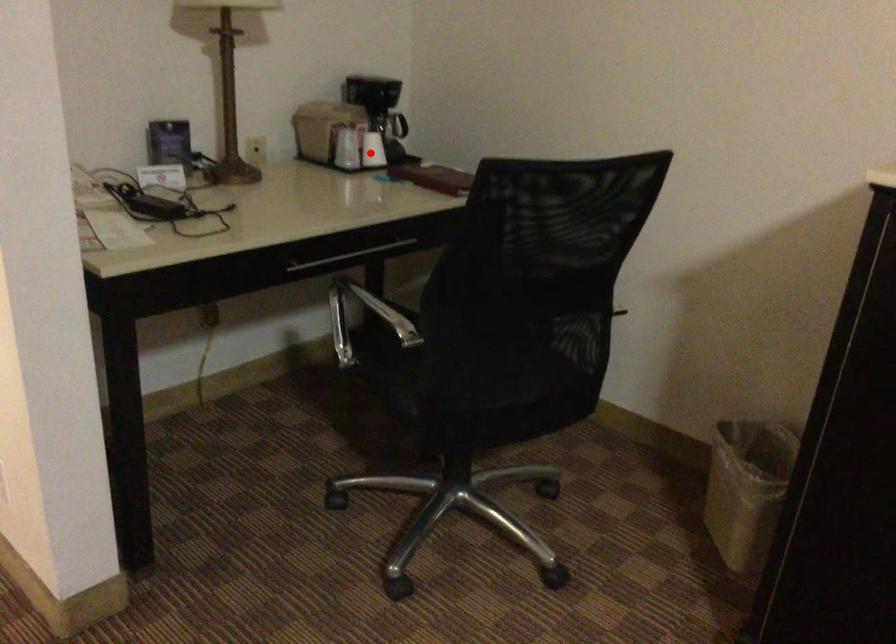
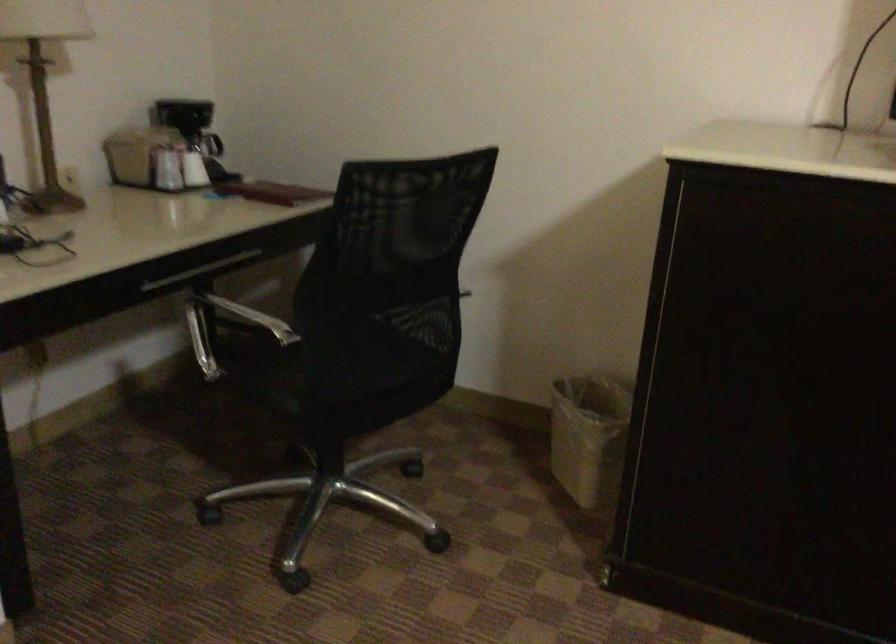
The point at the highlighted location is marked in the first image. Where is the corresponding point in the second image?

(194, 169)